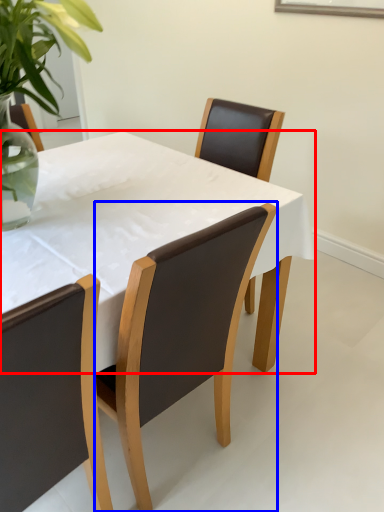
Question: Which object appears closest to the camera in this image, kitchen & dining room table (highlighted by a red box) or chair (highlighted by a blue box)?

Choices:
 (A) kitchen & dining room table
 (B) chair

Answer: (A)